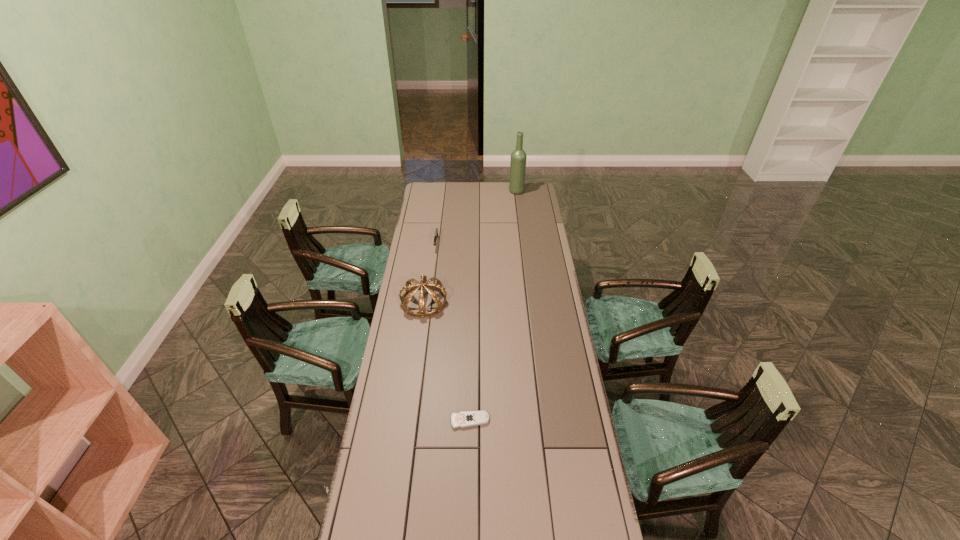
Locate an element on the screen. This screenshot has height=540, width=960. wine bottle is located at coordinates (518, 157).

Where is `the farthest object`? The width and height of the screenshot is (960, 540). the farthest object is located at coordinates (518, 157).

Find the location of a particular element. Image resolution: width=960 pixels, height=540 pixels. the second tallest object is located at coordinates (410, 289).

You are a GUI agent. You are given a task and a screenshot of the screen. Output one action in this format:
    pyautogui.click(x=<x>, y=<y>)
    Task: Click on the second nearest object
    Image resolution: width=960 pixels, height=540 pixels.
    Given the screenshot: What is the action you would take?
    pyautogui.click(x=410, y=289)

Where is `the second farthest object`? The height and width of the screenshot is (540, 960). the second farthest object is located at coordinates (436, 230).

In order to click on gun in this screenshot , I will do `click(436, 230)`.

Locate an element on the screen. This screenshot has width=960, height=540. the nearest object is located at coordinates (469, 418).

Identify the location of the third object from left to right. (469, 418).

This screenshot has height=540, width=960. I want to click on free point located on the left of the tallest object, so click(x=482, y=191).

Locate an element on the screen. vacant space located on the right of the tiara is located at coordinates (461, 302).